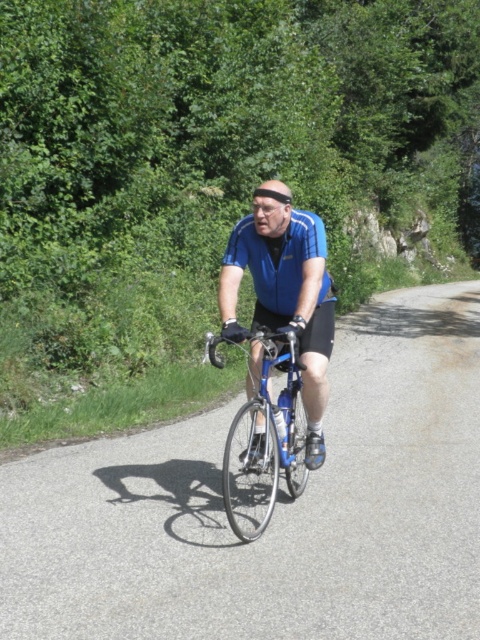
You are a drone operator trying to capture a photo of the cyclist. The drone is currently hovering above the asphalt road at center. To get a clear shot of the blue matte jersey at center, should you adjust the drone upwards or downwards?

The asphalt road at center has a lesser height compared to the blue matte jersey at center, so to capture the blue matte jersey at center clearly, the drone should be adjusted downwards towards the jersey.